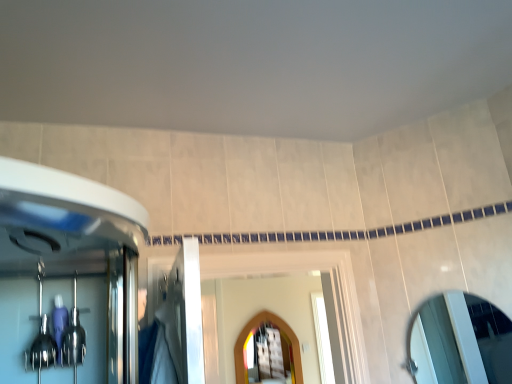
Question: Does wooden arched mirror at center, the 2th mirror from the right, appear on the left side of silver metallic mirror at right, acting as the first mirror starting from the right?

Choices:
 (A) yes
 (B) no

Answer: (A)

Question: Is wooden arched mirror at center, the 2th mirror from the right, taller than silver metallic mirror at right, marked as the second mirror in a back-to-front arrangement?

Choices:
 (A) yes
 (B) no

Answer: (A)

Question: Could silver metallic mirror at right, the 1th mirror in the front-to-back sequence, be considered to be inside wooden arched mirror at center, which is the second mirror from front to back?

Choices:
 (A) yes
 (B) no

Answer: (B)

Question: Is wooden arched mirror at center, arranged as the first mirror when viewed from the back, wider than silver metallic mirror at right, the 2th mirror viewed from the left?

Choices:
 (A) no
 (B) yes

Answer: (A)

Question: Is wooden arched mirror at center, the 1th mirror viewed from the left, bigger than silver metallic mirror at right, acting as the first mirror starting from the right?

Choices:
 (A) yes
 (B) no

Answer: (A)

Question: Does wooden arched mirror at center, the second mirror from the top, come behind silver metallic mirror at right, which ranks as the 2th mirror in bottom-to-top order?

Choices:
 (A) yes
 (B) no

Answer: (A)

Question: From a real-world perspective, is silver metallic mirror at right, which ranks as the 2th mirror in bottom-to-top order, over wooden arched mirror at center, which appears as the first mirror when ordered from the bottom?

Choices:
 (A) yes
 (B) no

Answer: (A)

Question: From a real-world perspective, is silver metallic mirror at right, which is the 1th mirror in top-to-bottom order, under wooden arched mirror at center, the 1th mirror viewed from the left?

Choices:
 (A) no
 (B) yes

Answer: (A)

Question: Is silver metallic mirror at right, acting as the first mirror starting from the right, facing towards wooden arched mirror at center, which is the second mirror from front to back?

Choices:
 (A) yes
 (B) no

Answer: (B)

Question: From the image's perspective, would you say silver metallic mirror at right, acting as the first mirror starting from the right, is positioned over wooden arched mirror at center, the 1th mirror viewed from the left?

Choices:
 (A) no
 (B) yes

Answer: (B)

Question: Is silver metallic mirror at right, acting as the first mirror starting from the right, not close to wooden arched mirror at center, which is the second mirror from front to back?

Choices:
 (A) yes
 (B) no

Answer: (A)

Question: Is silver metallic mirror at right, marked as the second mirror in a back-to-front arrangement, to the right of wooden arched mirror at center, arranged as the first mirror when viewed from the back, from the viewer's perspective?

Choices:
 (A) no
 (B) yes

Answer: (B)

Question: From the image's perspective, is wooden arched mirror at center, the 2th mirror from the right, located above or below silver metallic mirror at right, marked as the second mirror in a back-to-front arrangement?

Choices:
 (A) above
 (B) below

Answer: (B)